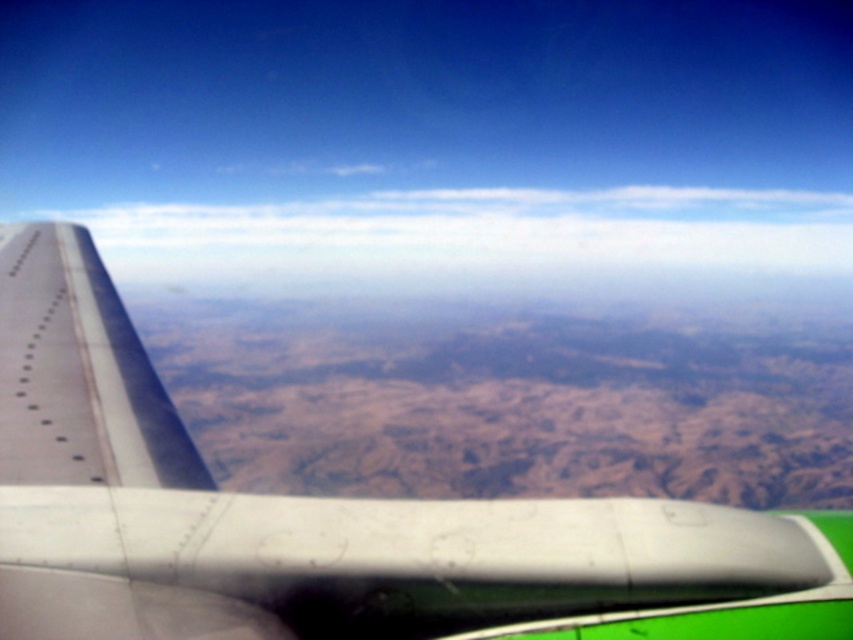
You are a passenger on an airplane and notice the metallic gray wing at left and the white fluffy cloud at upper center through the window. Which object appears narrower when viewed from your seat?

The metallic gray wing at left appears narrower than the white fluffy cloud at upper center because it is thinner.

You are a passenger sitting by the window on an airplane. You see the metallic gray wing at left and the white fluffy cloud at upper center outside. Which object is closer to the left side of the window?

The metallic gray wing at left is closer to the left side of the window because it is positioned to the left of the white fluffy cloud at upper center.

You are a pilot trying to assess the position of the metallic gray wing at left relative to the aircraft. Based on the coordinates provided, can you determine if the wing is positioned closer to the front or the rear of the aircraft?

The coordinates of the metallic gray wing at left are at point 0.812 on the x axis and 0.385 on the y axis. Since the x coordinate is closer to 1, the wing is positioned closer to the rear of the aircraft.